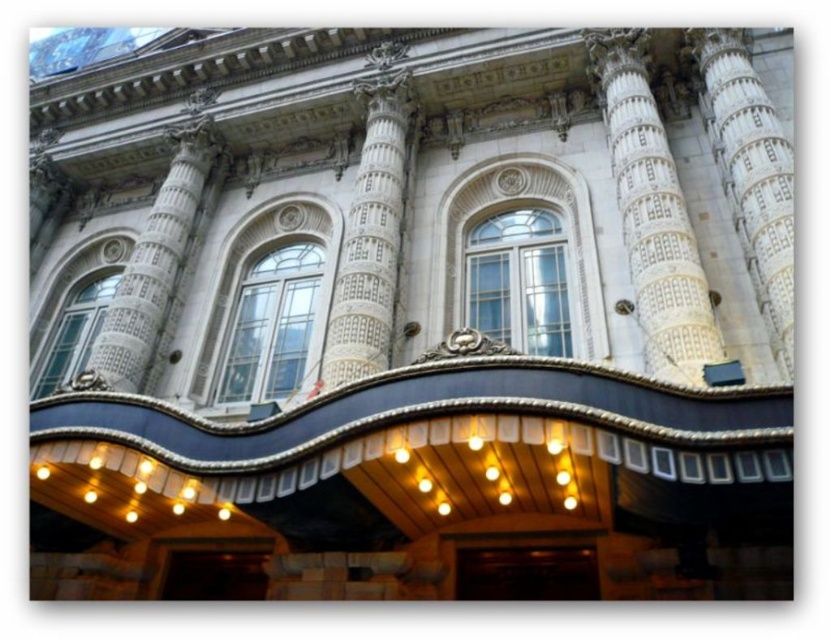
You are standing in front of the grand building and want to know the spatial relationship between the white textured column at center and the white marble column at upper left. Which one is positioned higher from the ground?

The white textured column at center is positioned higher from the ground than the white marble column at upper left because it is above it.

You are standing in front of the grand building and want to take a photo of the white textured column at center and the white marble column at upper left. Which column should you focus on first to ensure it appears larger in your photo?

The white textured column at center is closer to you than the white marble column at upper left, so it will naturally appear larger in the photo. Focus on the white textured column at center first to capture its size accurately.

You are standing in front of the grand building and notice a point marked at coordinates (x=751, y=173). What architectural feature does this point indicate?

The point at coordinates (x=751, y=173) marks the location of the white marble column at center.